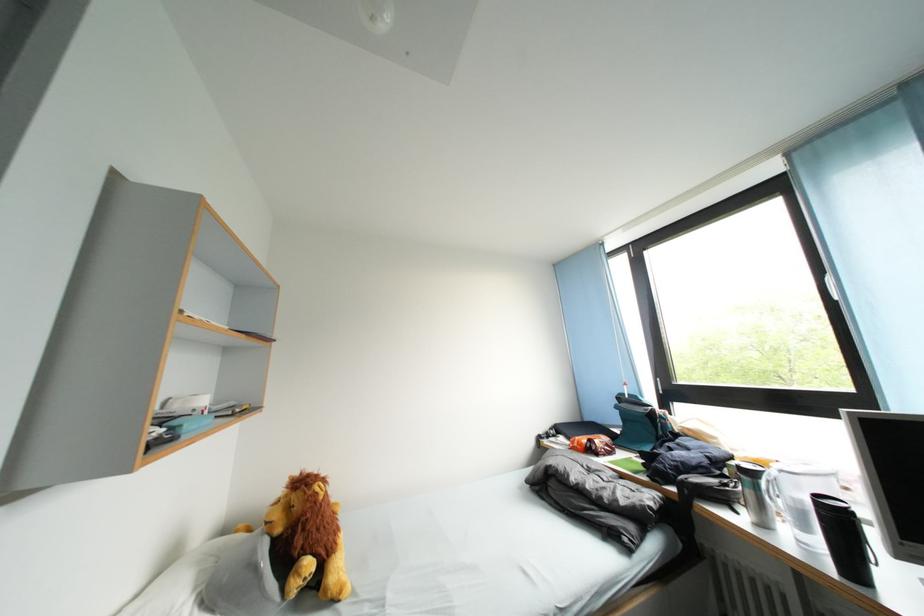
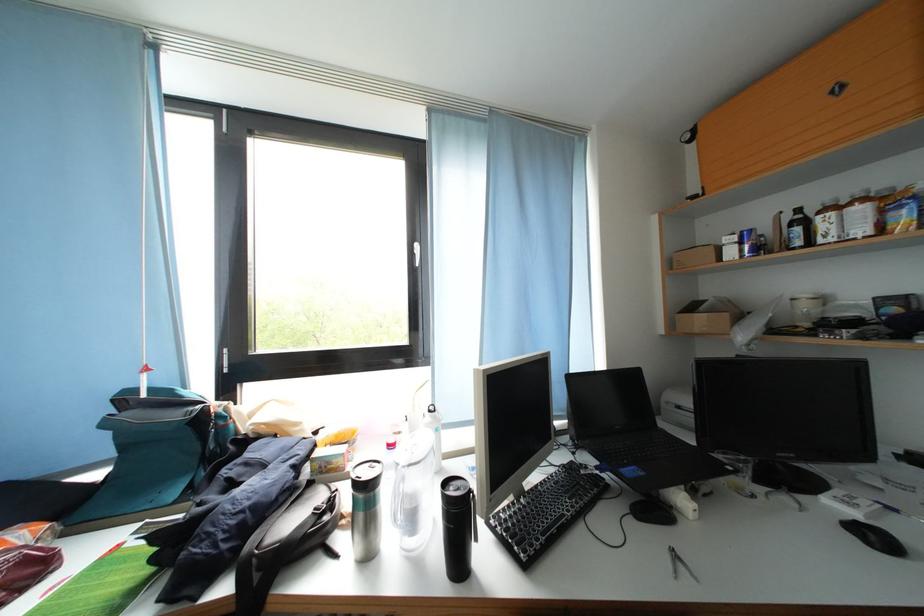
Locate, in the second image, the point that corresponds to (x=757, y=498) in the first image.

(369, 521)